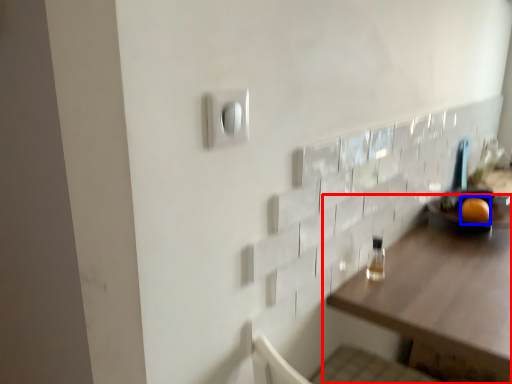
Question: Which object is further to the camera taking this photo, table (highlighted by a red box) or orange (highlighted by a blue box)?

Choices:
 (A) table
 (B) orange

Answer: (B)